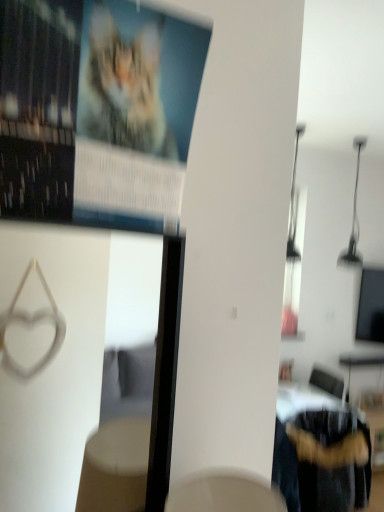
Question: Is matte paper poster at upper left in front of fuzzy fabric chair at lower right?

Choices:
 (A) no
 (B) yes

Answer: (B)

Question: Can you confirm if matte paper poster at upper left is bigger than fuzzy fabric chair at lower right?

Choices:
 (A) yes
 (B) no

Answer: (B)

Question: Would you consider matte paper poster at upper left to be distant from fuzzy fabric chair at lower right?

Choices:
 (A) no
 (B) yes

Answer: (B)

Question: Considering the relative sizes of matte paper poster at upper left and fuzzy fabric chair at lower right in the image provided, is matte paper poster at upper left taller than fuzzy fabric chair at lower right?

Choices:
 (A) no
 (B) yes

Answer: (A)

Question: Is matte paper poster at upper left at the right side of fuzzy fabric chair at lower right?

Choices:
 (A) no
 (B) yes

Answer: (A)

Question: Does matte paper poster at upper left have a lesser height compared to fuzzy fabric chair at lower right?

Choices:
 (A) no
 (B) yes

Answer: (B)

Question: Does fuzzy fabric chair at lower right appear on the left side of matte paper poster at upper left?

Choices:
 (A) no
 (B) yes

Answer: (A)

Question: Is fuzzy fabric chair at lower right further to camera compared to matte paper poster at upper left?

Choices:
 (A) no
 (B) yes

Answer: (B)

Question: From a real-world perspective, is fuzzy fabric chair at lower right located beneath matte paper poster at upper left?

Choices:
 (A) yes
 (B) no

Answer: (A)

Question: From the image's perspective, is fuzzy fabric chair at lower right below matte paper poster at upper left?

Choices:
 (A) yes
 (B) no

Answer: (A)

Question: Is fuzzy fabric chair at lower right turned away from matte paper poster at upper left?

Choices:
 (A) no
 (B) yes

Answer: (A)

Question: Is the depth of fuzzy fabric chair at lower right less than that of matte paper poster at upper left?

Choices:
 (A) no
 (B) yes

Answer: (A)

Question: Considering their positions, is matte paper poster at upper left located in front of or behind fuzzy fabric chair at lower right?

Choices:
 (A) front
 (B) behind

Answer: (A)